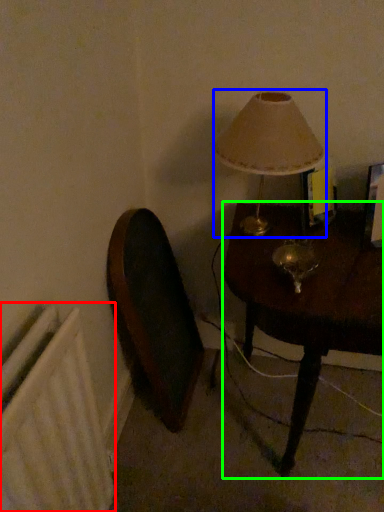
Question: Considering the real-world distances, which object is closest to radiator (highlighted by a red box)? lamp (highlighted by a blue box) or table (highlighted by a green box).

Choices:
 (A) lamp
 (B) table

Answer: (B)